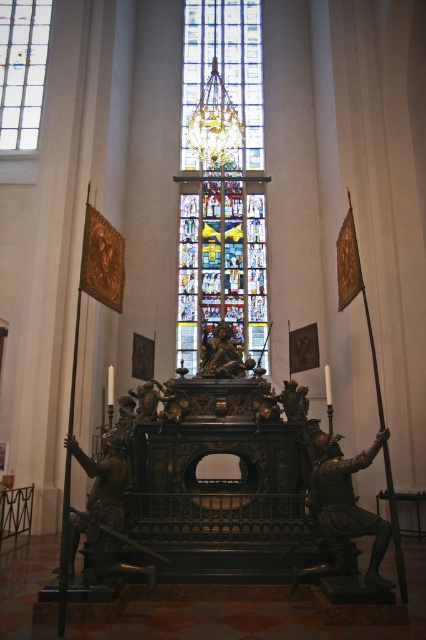
Does clear glass stained glass at upper center have a smaller size compared to polished bronze statue at center?

No.

Between clear glass stained glass at upper center and polished bronze statue at center, which one is positioned lower?

polished bronze statue at center

Between point (28, 81) and point (232, 340), which one is positioned in front?

Point (232, 340)

Locate an element on the screen. clear glass stained glass at upper center is located at coordinates (22, 68).

Does point (316, 529) lie in front of point (20, 36)?

Yes, it is in front of point (20, 36).

Can you confirm if bronze statue at right is positioned to the right of clear glass stained glass at upper center?

Indeed, bronze statue at right is positioned on the right side of clear glass stained glass at upper center.

Identify the location of bronze statue at right. (342, 508).

Who is shorter, multicolored stained glass at center or polished bronze statue at center?

polished bronze statue at center

Does multicolored stained glass at center have a lesser height compared to polished bronze statue at center?

In fact, multicolored stained glass at center may be taller than polished bronze statue at center.

Does point (187, 288) come closer to viewer compared to point (230, 339)?

No, (187, 288) is behind (230, 339).

Locate an element on the screen. The height and width of the screenshot is (640, 426). multicolored stained glass at center is located at coordinates (221, 266).